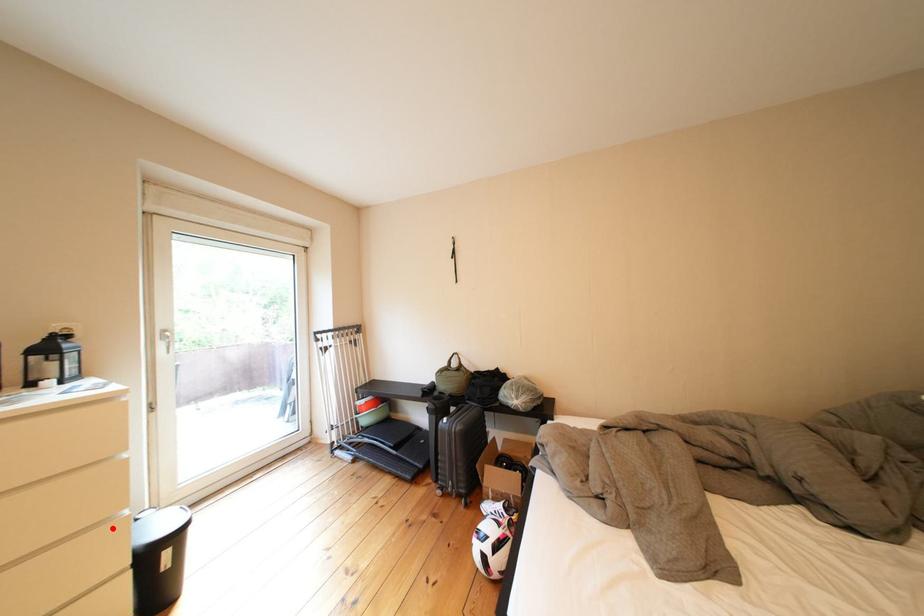
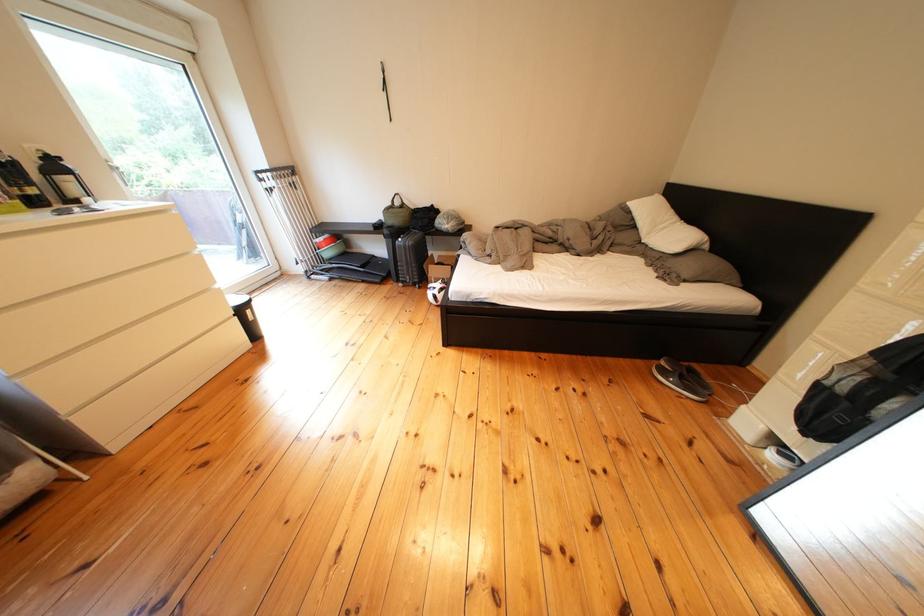
Where in the second image is the point corresponding to the highlighted location from the first image?

(220, 294)